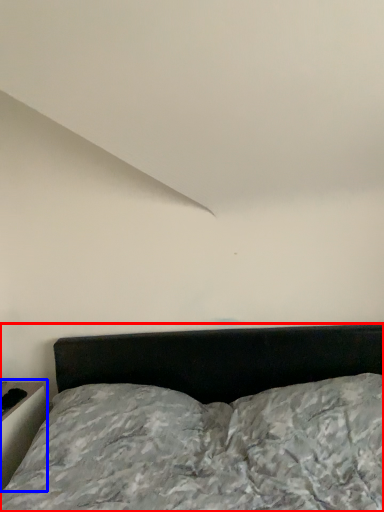
Question: Which object appears farthest to the camera in this image, bed (highlighted by a red box) or table (highlighted by a blue box)?

Choices:
 (A) bed
 (B) table

Answer: (B)